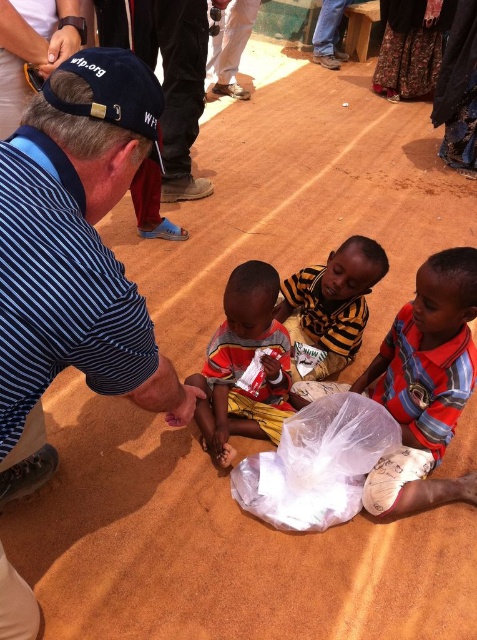
Based on the scene description, where is the striped fabric shirt at center located in terms of coordinates?

The striped fabric shirt at center is located at coordinates point (245, 364).

You are a photographer trying to capture a group photo of the blue striped shirt at center and the striped fabric shirt at lower right. Which one should you focus on first if you want to ensure both are in frame without moving the camera?

You should focus on the blue striped shirt at center first because it is shorter than the striped fabric shirt at lower right, so adjusting the camera angle to include the taller one might still capture the shorter one in the frame.

You are a fashion designer analyzing clothing sizes in the image. The blue striped shirt at center and striped fabric shirt at lower right are both striped shirts. Which one has a narrower width?

The blue striped shirt at center has a narrower width than the striped fabric shirt at lower right.